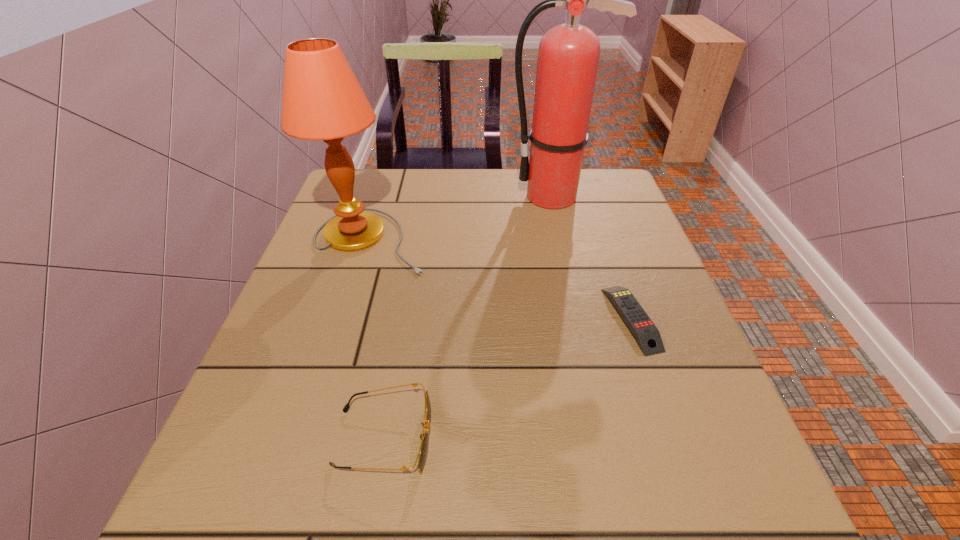
This screenshot has height=540, width=960. Find the location of `vacant space at the far edge`. vacant space at the far edge is located at coordinates (448, 171).

Where is `free region at the near edge of the desktop`? The height and width of the screenshot is (540, 960). free region at the near edge of the desktop is located at coordinates (404, 520).

Where is `vacant point at the left edge`? Image resolution: width=960 pixels, height=540 pixels. vacant point at the left edge is located at coordinates (320, 354).

Identify the location of blank area at the right edge. The width and height of the screenshot is (960, 540). (635, 255).

Identify the location of free space at the far left corner of the desktop. (354, 195).

Locate an element on the screen. This screenshot has width=960, height=540. vacant region at the near right corner of the desktop is located at coordinates (729, 512).

This screenshot has width=960, height=540. What are the coordinates of `vacant area between the fire extinguisher and the nearest object` in the screenshot? It's located at (468, 317).

The width and height of the screenshot is (960, 540). Identify the location of free space that is in between the remote control and the lamp. (501, 280).

Locate an element on the screen. Image resolution: width=960 pixels, height=540 pixels. unoccupied position between the lamp and the sunglasses is located at coordinates (377, 339).

The image size is (960, 540). Identify the location of vacant point located between the second nearest object and the fire extinguisher. (592, 258).